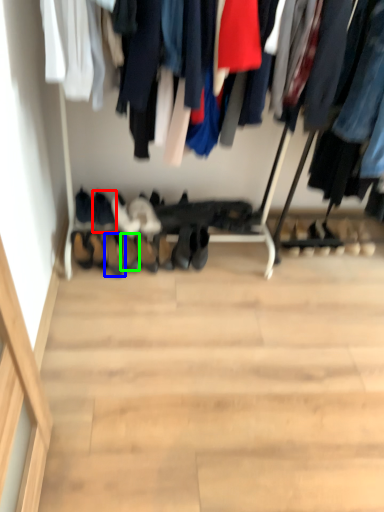
Question: Which object is the closest to the footwear (highlighted by a red box)? Choose among these: footwear (highlighted by a blue box) or shoe (highlighted by a green box).

Choices:
 (A) footwear
 (B) shoe

Answer: (A)